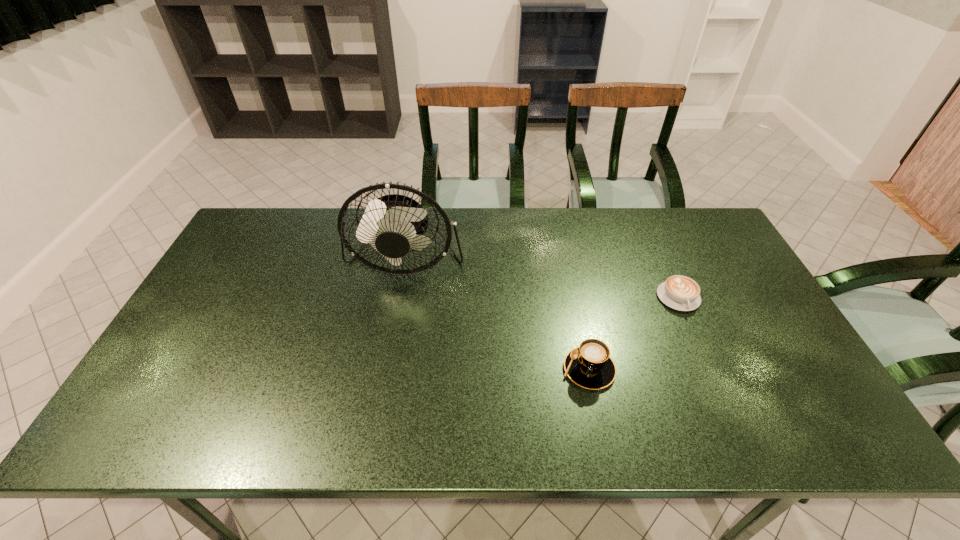
This screenshot has width=960, height=540. Identify the location of fan. (392, 224).

The height and width of the screenshot is (540, 960). What are the coordinates of `the tallest object` in the screenshot? It's located at (392, 224).

You are a GUI agent. You are given a task and a screenshot of the screen. Output one action in this format:
    pyautogui.click(x=<x>, y=<y>)
    Task: Click on the nearer cappuccino
    
    Given the screenshot: What is the action you would take?
    pyautogui.click(x=590, y=366)

I want to click on the left cappuccino, so click(x=590, y=366).

Find the location of a particular element. This screenshot has height=540, width=960. the rightmost object is located at coordinates (679, 292).

Find the location of a particular element. The height and width of the screenshot is (540, 960). the farther cappuccino is located at coordinates pyautogui.click(x=679, y=292).

Where is `vacant area located in front of the fan, directing airflow`? This screenshot has width=960, height=540. vacant area located in front of the fan, directing airflow is located at coordinates (387, 362).

Image resolution: width=960 pixels, height=540 pixels. I want to click on vacant space located on the right of the second shortest object, so click(x=720, y=369).

This screenshot has width=960, height=540. What are the coordinates of `free space located 0.150m on the side of the shorter cappuccino with the handle` in the screenshot? It's located at (706, 359).

Find the location of a particular element. object at the far edge is located at coordinates (392, 224).